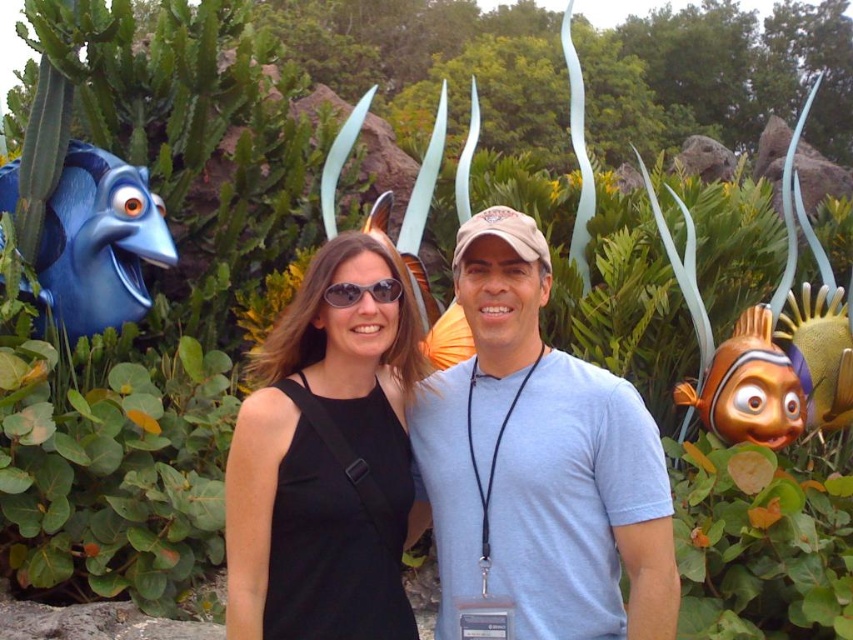
Who is shorter, light blue cotton t-shirt at center or matte blue fish at left?

matte blue fish at left

Does light blue cotton t-shirt at center have a lesser width compared to matte blue fish at left?

In fact, light blue cotton t-shirt at center might be wider than matte blue fish at left.

Who is more distant from viewer, (492, 291) or (102, 208)?

Point (102, 208)

Where is `light blue cotton t-shirt at center`? The width and height of the screenshot is (853, 640). light blue cotton t-shirt at center is located at coordinates (538, 461).

Looking at this image, does black matte dress at center appear on the right side of matte blue fish at left?

Yes, black matte dress at center is to the right of matte blue fish at left.

Is black matte dress at center further to camera compared to matte blue fish at left?

No, black matte dress at center is in front of matte blue fish at left.

Measure the distance between point (283, 419) and camera.

Point (283, 419) and camera are 4.26 meters apart.

At what (x,y) coordinates should I click in order to perform the action: click on black matte dress at center. Please return your answer as a coordinate pair (x, y). The height and width of the screenshot is (640, 853). Looking at the image, I should click on [x=325, y=458].

Which is in front, point (521, 429) or point (398, 636)?

Point (398, 636)

Which is more to the right, light blue cotton t-shirt at center or black matte dress at center?

light blue cotton t-shirt at center is more to the right.

Does point (495, 381) come farther from viewer compared to point (408, 394)?

No, (495, 381) is closer to viewer.

The height and width of the screenshot is (640, 853). In order to click on light blue cotton t-shirt at center in this screenshot , I will do `click(538, 461)`.